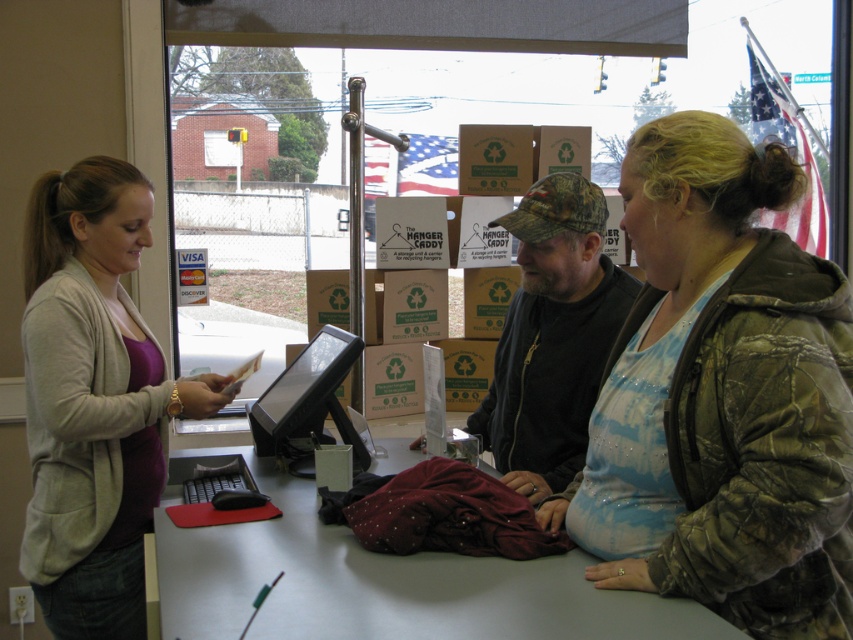
You are a customer at this retail store and need to hand an item to the person wearing the camo jacket at center. Where should you approach relative to their position?

The camo jacket at center is located at point (722, 396), so you should approach the person wearing the camo jacket at center from the direction of those coordinates.

You are a customer at the counter. You need to hand over a payment to the cashier. The cashier is standing behind the counter. There are two people in front of you. One is wearing a camo jacket at center and another is wearing camouflage hat at center. Which person should you wait behind in the queue?

You should wait behind the person wearing the camo jacket at center because the camo jacket at center is below camouflage hat at center, indicating they are closer to the counter and ahead in the queue.

You are a delivery person who needs to place a package on the white plastic table at center. The package is 1.5 meters long. Can you fit it on the table?

The distance between the two people at the counter is 1.33 meters, which is shorter than the package length of 1.5 meters. Therefore, the package cannot be placed on the white plastic table at center.